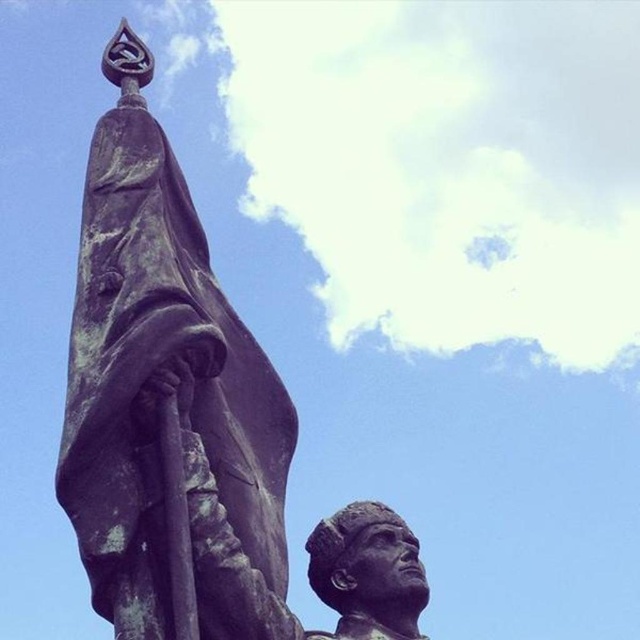
Can you confirm if bronze statue at left is wider than bronze statue head at center?

Yes, bronze statue at left is wider than bronze statue head at center.

The image size is (640, 640). Find the location of `bronze statue at left`. bronze statue at left is located at coordinates (168, 403).

What do you see at coordinates (168, 403) in the screenshot?
I see `bronze statue at left` at bounding box center [168, 403].

Where is `bronze statue at left`? Image resolution: width=640 pixels, height=640 pixels. bronze statue at left is located at coordinates (168, 403).